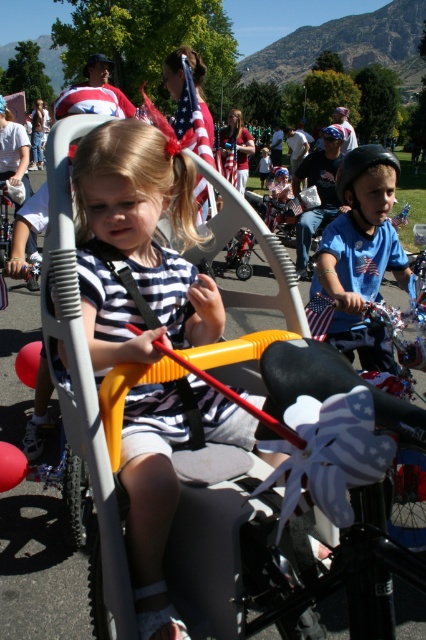
Does striped fabric shirt at center have a greater width compared to blue matte shirt at center?

Incorrect, striped fabric shirt at center's width does not surpass blue matte shirt at center's.

Which of these two, striped fabric shirt at center or blue matte shirt at center, stands taller?

With more height is striped fabric shirt at center.

Where is `striped fabric shirt at center`? Image resolution: width=426 pixels, height=640 pixels. striped fabric shirt at center is located at coordinates (138, 244).